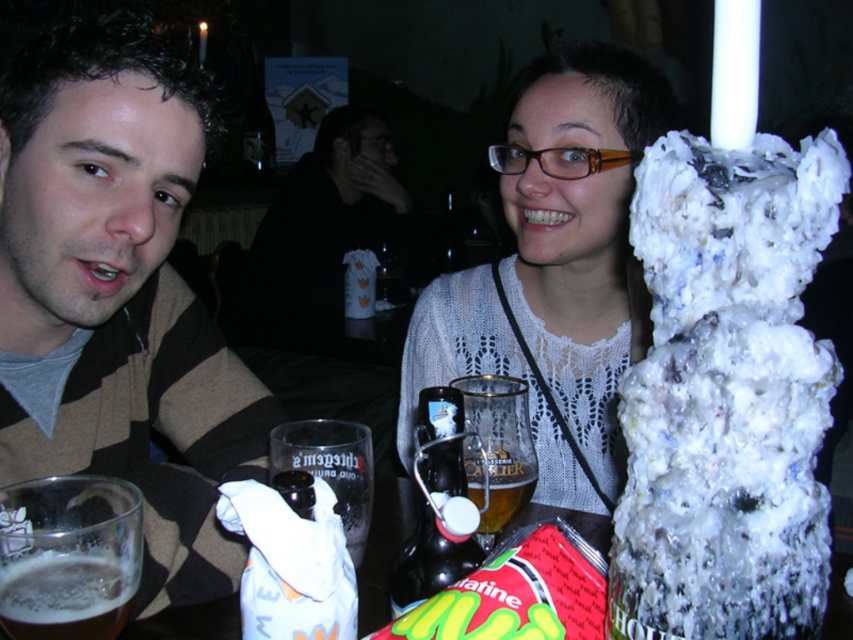
Is point (219, 340) behind point (397, 428)?

No, (219, 340) is closer to viewer.

Can you confirm if striped sweater at left is positioned below white knitted sweater at upper center?

Yes.

Who is more distant from viewer, (x=76, y=97) or (x=408, y=340)?

The point (x=408, y=340) is more distant.

This screenshot has height=640, width=853. In order to click on striped sweater at left in this screenshot , I will do `click(119, 296)`.

Between white fluffy cake at right and foamy white beer at lower left, which one appears on the left side from the viewer's perspective?

foamy white beer at lower left

Does white fluffy cake at right appear over foamy white beer at lower left?

Indeed, white fluffy cake at right is positioned over foamy white beer at lower left.

Describe the element at coordinates (726, 396) in the screenshot. The height and width of the screenshot is (640, 853). I see `white fluffy cake at right` at that location.

Locate an element on the screen. white fluffy cake at right is located at coordinates (726, 396).

Is white fluffy cake at right smaller than white knitted sweater at upper center?

Correct, white fluffy cake at right occupies less space than white knitted sweater at upper center.

Is white fluffy cake at right closer to the viewer compared to white knitted sweater at upper center?

Yes, white fluffy cake at right is closer to the viewer.

Which is behind, point (837, 218) or point (611, 403)?

The point (611, 403) is behind.

You are a GUI agent. You are given a task and a screenshot of the screen. Output one action in this format:
    pyautogui.click(x=<x>, y=<y>)
    Task: Click on the white fluffy cake at right
    
    Given the screenshot: What is the action you would take?
    pyautogui.click(x=726, y=396)